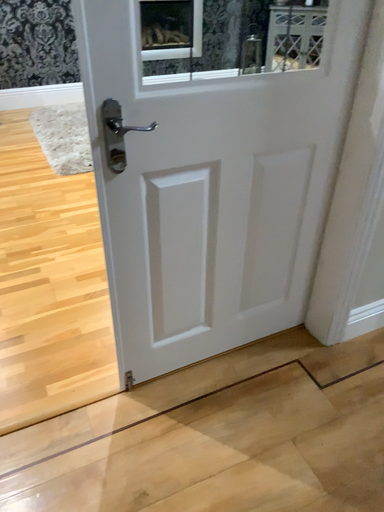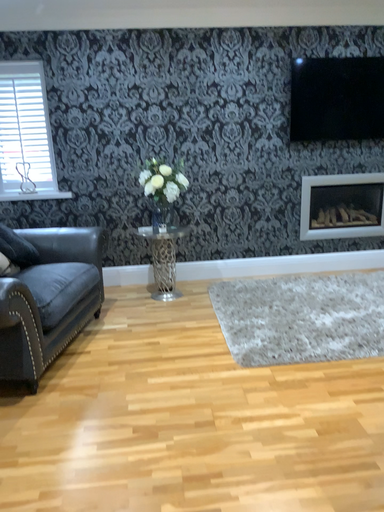
Question: How did the camera likely rotate when shooting the video?

Choices:
 (A) rotated right
 (B) rotated left

Answer: (B)